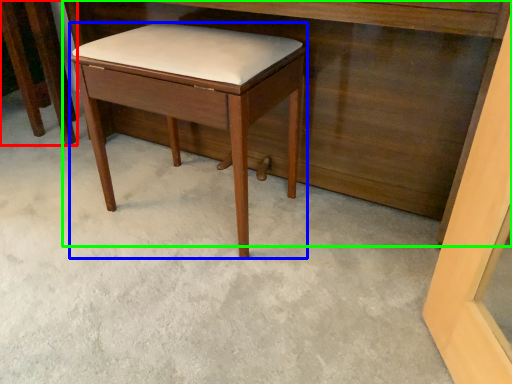
Question: Which object is positioned farthest from furniture (highlighted by a red box)? Select from stool (highlighted by a blue box) and vanity (highlighted by a green box).

Choices:
 (A) stool
 (B) vanity

Answer: (A)